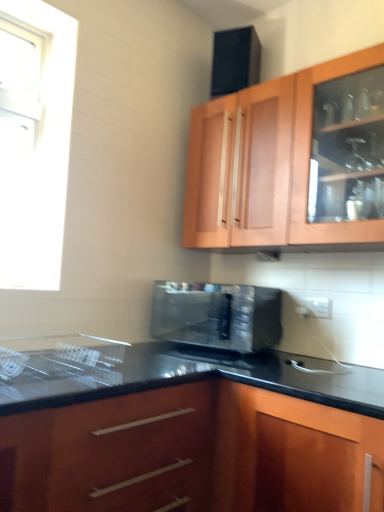
Question: Can you confirm if satin black microwave at center is wider than wooden cabinet at upper center, acting as the 2th cabinetry starting from the bottom?

Choices:
 (A) yes
 (B) no

Answer: (A)

Question: Is satin black microwave at center positioned beyond the bounds of wooden cabinet at upper center, the first cabinetry when ordered from top to bottom?

Choices:
 (A) no
 (B) yes

Answer: (B)

Question: Could wooden cabinet at upper center, the first cabinetry when ordered from top to bottom, be considered to be inside satin black microwave at center?

Choices:
 (A) yes
 (B) no

Answer: (B)

Question: Is satin black microwave at center with wooden cabinet at upper center, the first cabinetry when ordered from top to bottom?

Choices:
 (A) no
 (B) yes

Answer: (A)

Question: From a real-world perspective, is satin black microwave at center physically above wooden cabinet at upper center, the first cabinetry when ordered from top to bottom?

Choices:
 (A) yes
 (B) no

Answer: (B)

Question: Is wooden cabinet at upper center, the first cabinetry when ordered from top to bottom, at the back of satin black microwave at center?

Choices:
 (A) yes
 (B) no

Answer: (B)

Question: Does wooden cabinet at upper center, the first cabinetry when ordered from top to bottom, appear on the left side of satin black microwave at center?

Choices:
 (A) yes
 (B) no

Answer: (B)

Question: Is wooden cabinet at upper center, acting as the 2th cabinetry starting from the bottom, positioned beyond the bounds of satin black microwave at center?

Choices:
 (A) yes
 (B) no

Answer: (A)

Question: Considering the relative positions of wooden cabinet at upper center, the first cabinetry when ordered from top to bottom, and satin black microwave at center in the image provided, is wooden cabinet at upper center, the first cabinetry when ordered from top to bottom, to the right of satin black microwave at center from the viewer's perspective?

Choices:
 (A) yes
 (B) no

Answer: (A)

Question: Is wooden cabinet at upper center, acting as the 2th cabinetry starting from the bottom, in front of satin black microwave at center?

Choices:
 (A) yes
 (B) no

Answer: (A)

Question: Does wooden cabinet at upper center, the first cabinetry when ordered from top to bottom, have a lesser height compared to satin black microwave at center?

Choices:
 (A) yes
 (B) no

Answer: (B)

Question: From the image's perspective, is wooden cabinet at upper center, the first cabinetry when ordered from top to bottom, beneath satin black microwave at center?

Choices:
 (A) no
 (B) yes

Answer: (A)

Question: Does satin black microwave at center turn towards glossy wood cabinet at lower center, which is the 2th cabinetry from top to bottom?

Choices:
 (A) no
 (B) yes

Answer: (A)